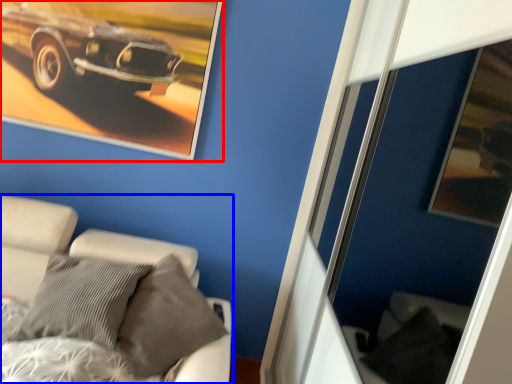
Question: Which object appears closest to the camera in this image, picture frame (highlighted by a red box) or furniture (highlighted by a blue box)?

Choices:
 (A) picture frame
 (B) furniture

Answer: (B)